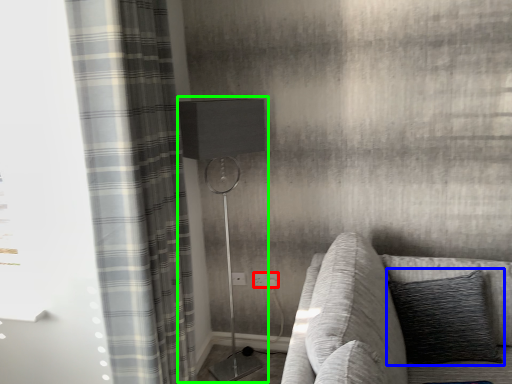
Question: Which object is positioned closest to electric outlet (highlighted by a red box)? Select from pillow (highlighted by a blue box) and table lamp (highlighted by a green box).

Choices:
 (A) pillow
 (B) table lamp

Answer: (B)